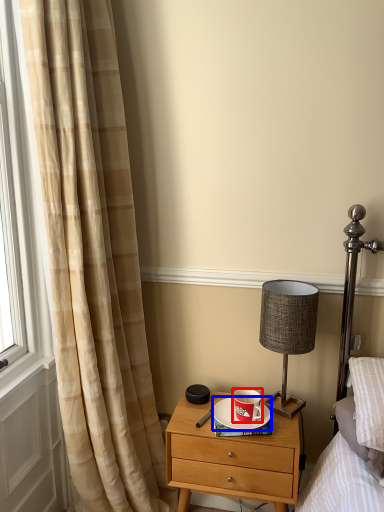
Question: Among these objects, which one is nearest to the camera, coffee cup (highlighted by a red box) or saucer (highlighted by a blue box)?

Choices:
 (A) coffee cup
 (B) saucer

Answer: (A)